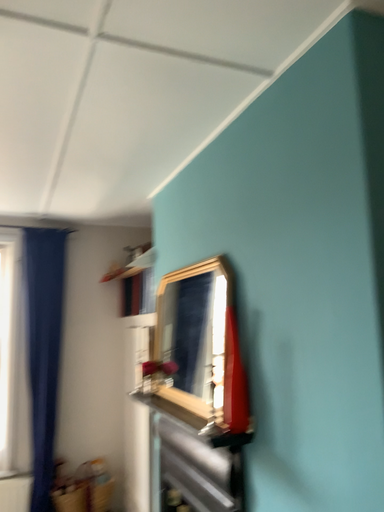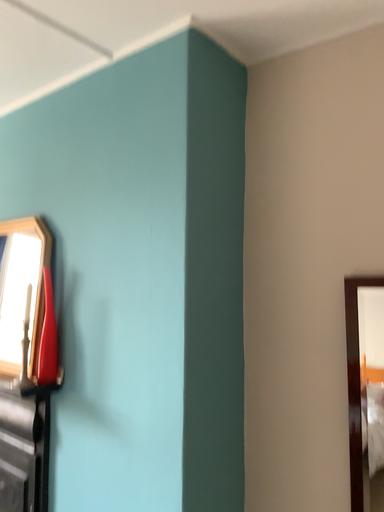
Question: How did the camera likely rotate when shooting the video?

Choices:
 (A) rotated left
 (B) rotated right

Answer: (B)